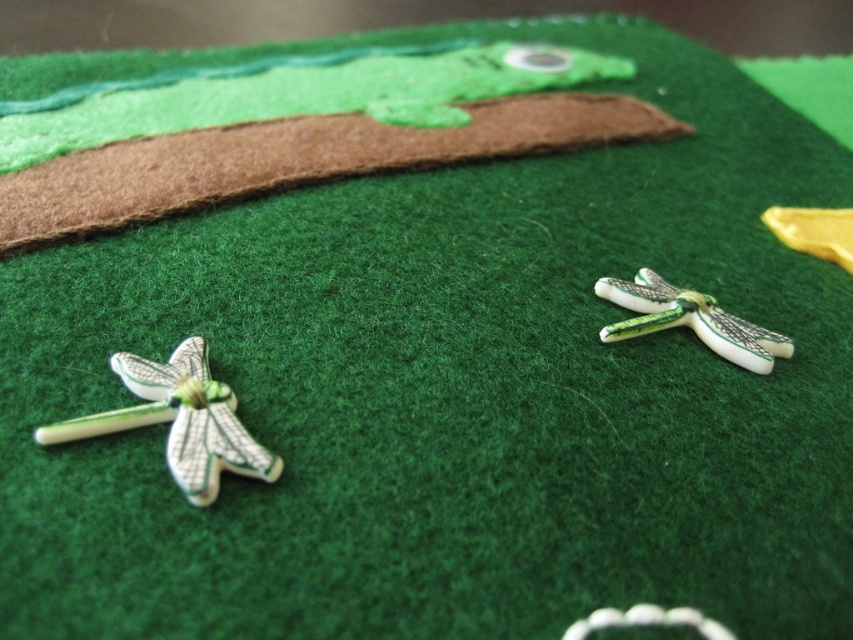
Locate an element on the screen. white glossy dragonfly at lower left is located at coordinates (178, 420).

Does white glossy dragonfly at lower left have a smaller size compared to green glossy dragonfly at right?

Incorrect, white glossy dragonfly at lower left is not smaller in size than green glossy dragonfly at right.

The image size is (853, 640). Find the location of `white glossy dragonfly at lower left`. white glossy dragonfly at lower left is located at coordinates (178, 420).